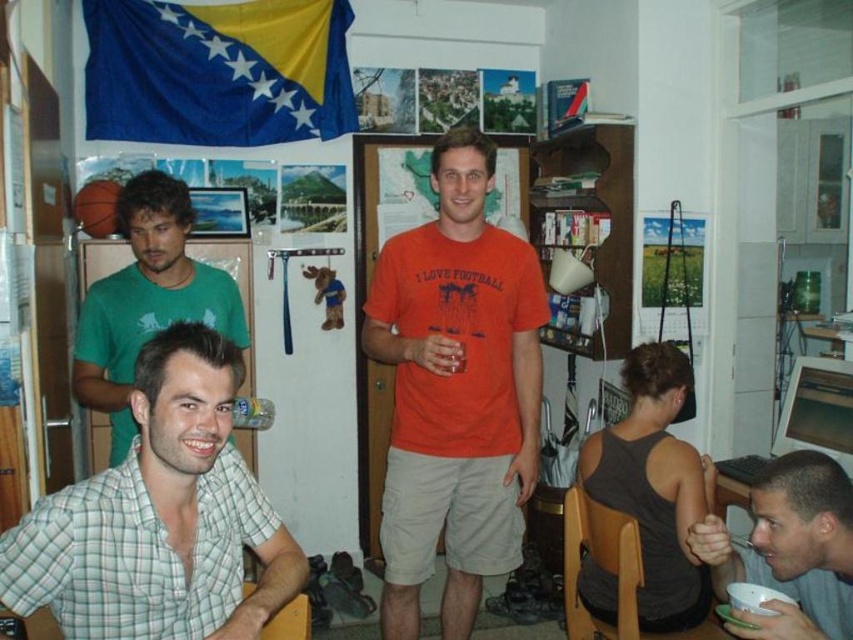
Question: Among these points, which one is nearest to the camera?

Choices:
 (A) (219, 412)
 (B) (482, 563)

Answer: (A)

Question: Which point is closer to the camera?

Choices:
 (A) (440, 362)
 (B) (432, 518)

Answer: (A)

Question: Is smooth gray bowl at lower right to the left of clear plastic bottle at center from the viewer's perspective?

Choices:
 (A) no
 (B) yes

Answer: (A)

Question: Is orange cotton t-shirt at center further to the viewer compared to smooth gray bowl at lower right?

Choices:
 (A) yes
 (B) no

Answer: (A)

Question: Is the position of smooth gray bowl at lower right more distant than that of clear plastic bottle at center?

Choices:
 (A) yes
 (B) no

Answer: (B)

Question: Based on their relative distances, which object is nearer to the green checkered shirt at left?

Choices:
 (A) clear plastic bottle at center
 (B) smooth gray bowl at lower right

Answer: (A)